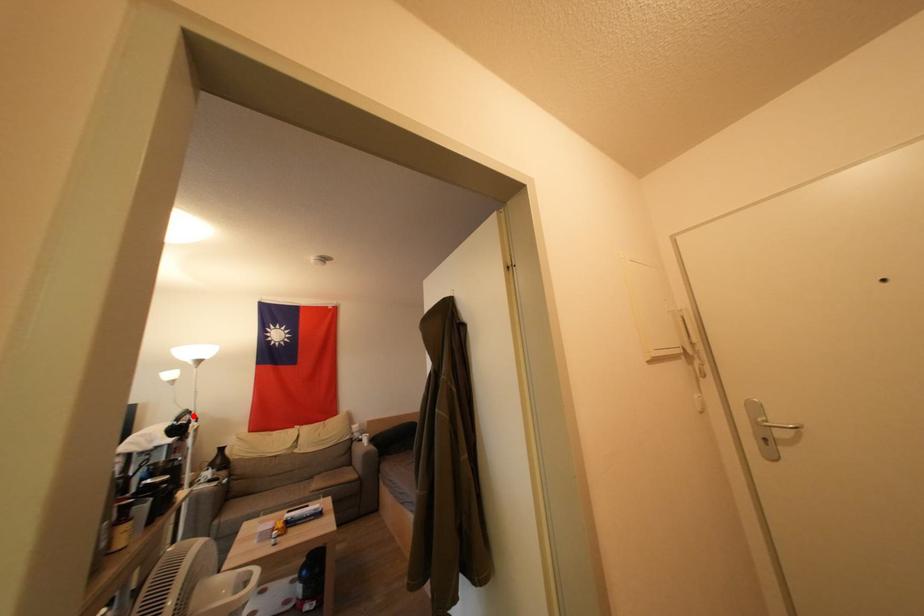
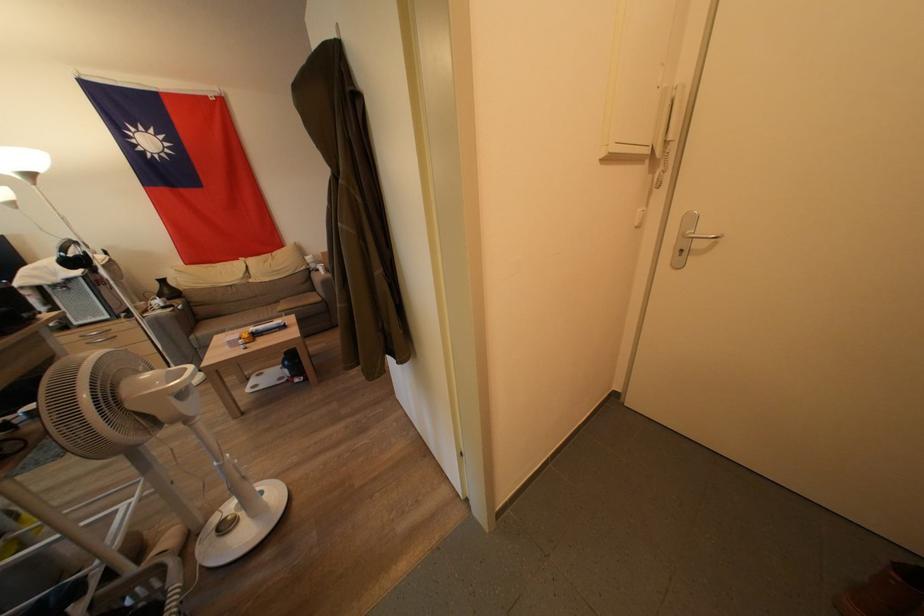
Question: A red point is marked in image1. In image2, is the corresponding 3D point closer to the camera or farther? Reply with the corresponding letter.

Choices:
 (A) The corresponding 3D point is closer.
 (B) The corresponding 3D point is farther.

Answer: (B)